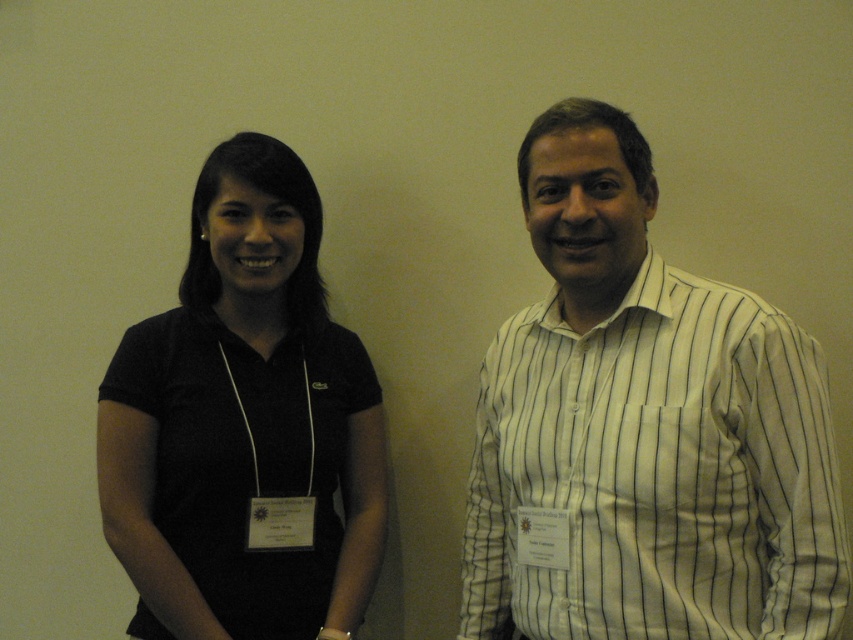
Question: Considering the relative positions of white striped shirt at right and black fabric shirt at left in the image provided, where is white striped shirt at right located with respect to black fabric shirt at left?

Choices:
 (A) left
 (B) right

Answer: (B)

Question: Which object is closer to the camera taking this photo?

Choices:
 (A) white striped shirt at right
 (B) black fabric shirt at left

Answer: (A)

Question: Observing the image, what is the correct spatial positioning of white striped shirt at right in reference to black fabric shirt at left?

Choices:
 (A) above
 (B) below

Answer: (A)

Question: Can you confirm if white striped shirt at right is bigger than black fabric shirt at left?

Choices:
 (A) yes
 (B) no

Answer: (A)

Question: Which object is farther from the camera taking this photo?

Choices:
 (A) black fabric shirt at left
 (B) white striped shirt at right

Answer: (A)